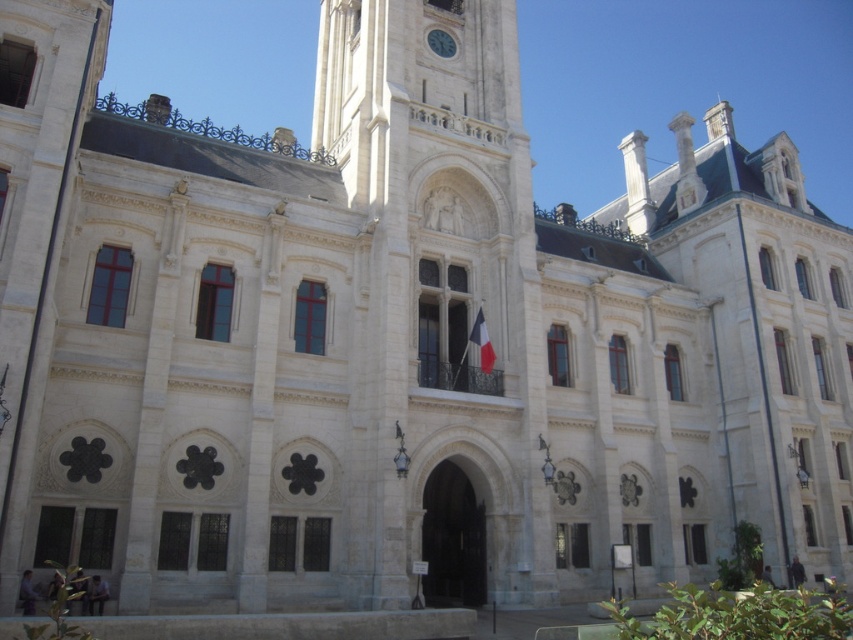
Question: In this image, where is polished fabric flag at center located relative to white stone clock at upper center?

Choices:
 (A) below
 (B) above

Answer: (A)

Question: Does polished fabric flag at center come in front of white stone clock at upper center?

Choices:
 (A) no
 (B) yes

Answer: (B)

Question: Which object is farther from the camera taking this photo?

Choices:
 (A) polished fabric flag at center
 (B) white stone clock at upper center

Answer: (B)

Question: Does polished fabric flag at center appear over white stone clock at upper center?

Choices:
 (A) no
 (B) yes

Answer: (A)